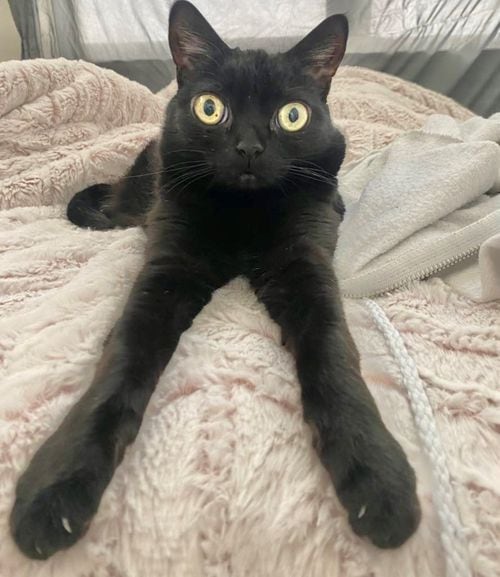
What are the coordinates of `blanket surrounding cat` in the screenshot? It's located at (61, 108), (364, 85), (451, 372), (246, 393), (59, 301).